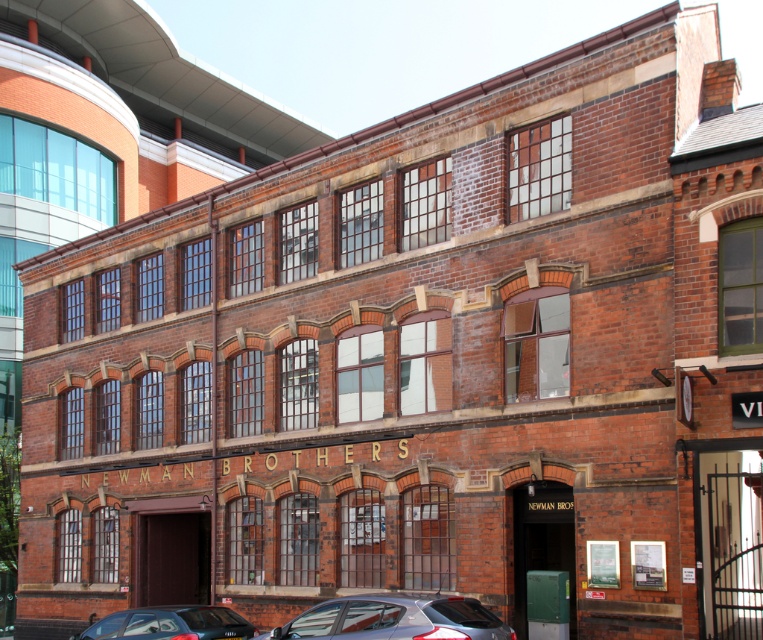
Question: Which point is farther from the camera taking this photo?

Choices:
 (A) (488, 630)
 (B) (240, 632)

Answer: (B)

Question: Which of the following is the closest to the observer?

Choices:
 (A) shiny black car at lower left
 (B) satin silver car at lower center

Answer: (B)

Question: From the image, what is the correct spatial relationship of satin silver car at lower center in relation to shiny black car at lower left?

Choices:
 (A) above
 (B) below

Answer: (A)

Question: Which object appears farthest from the camera in this image?

Choices:
 (A) shiny black car at lower left
 (B) satin silver car at lower center

Answer: (A)

Question: From the image, what is the correct spatial relationship of satin silver car at lower center in relation to shiny black car at lower left?

Choices:
 (A) right
 (B) left

Answer: (A)

Question: Does satin silver car at lower center appear on the right side of shiny black car at lower left?

Choices:
 (A) no
 (B) yes

Answer: (B)